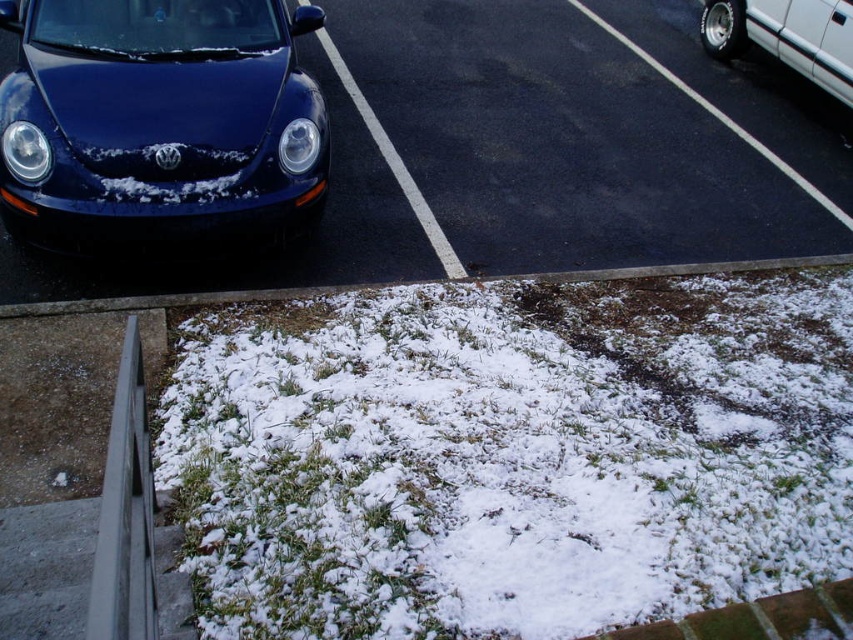
Question: Can you confirm if snow-covered asphalt at upper center is wider than white metallic car at upper right?

Choices:
 (A) no
 (B) yes

Answer: (B)

Question: Considering the real-world distances, which object is closest to the snow-covered asphalt at upper center?

Choices:
 (A) white fluffy snow at lower center
 (B) matte blue car at left

Answer: (A)

Question: From the image, what is the correct spatial relationship of snow-covered asphalt at upper center in relation to white metallic car at upper right?

Choices:
 (A) above
 (B) below

Answer: (B)

Question: Which point is closer to the camera taking this photo?

Choices:
 (A) (x=837, y=355)
 (B) (x=283, y=177)
 (C) (x=650, y=204)

Answer: (B)

Question: Is matte blue car at left below white metallic car at upper right?

Choices:
 (A) yes
 (B) no

Answer: (A)

Question: Estimate the real-world distances between objects in this image. Which object is farther from the snow-covered asphalt at upper center?

Choices:
 (A) white fluffy snow at lower center
 (B) white metallic car at upper right
 (C) matte blue car at left

Answer: (B)